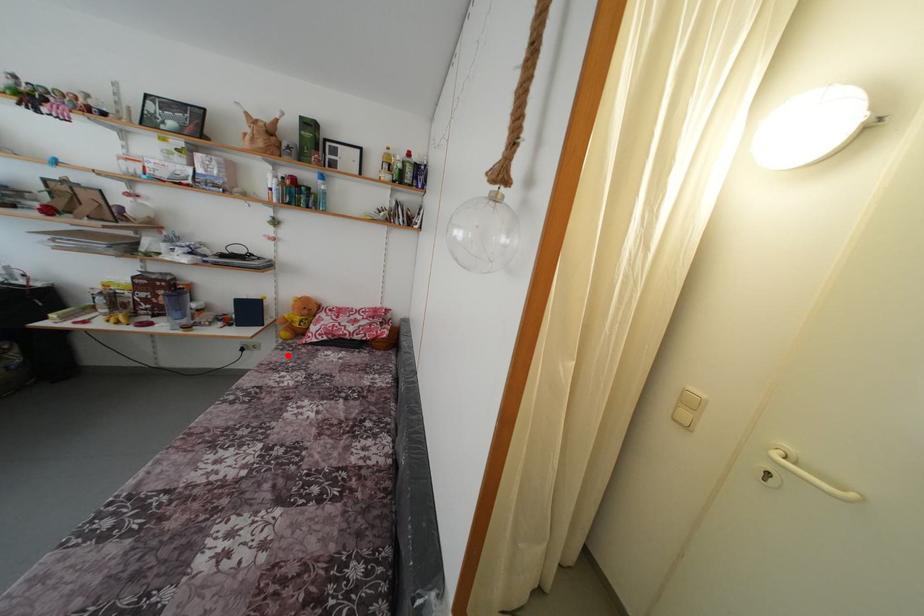
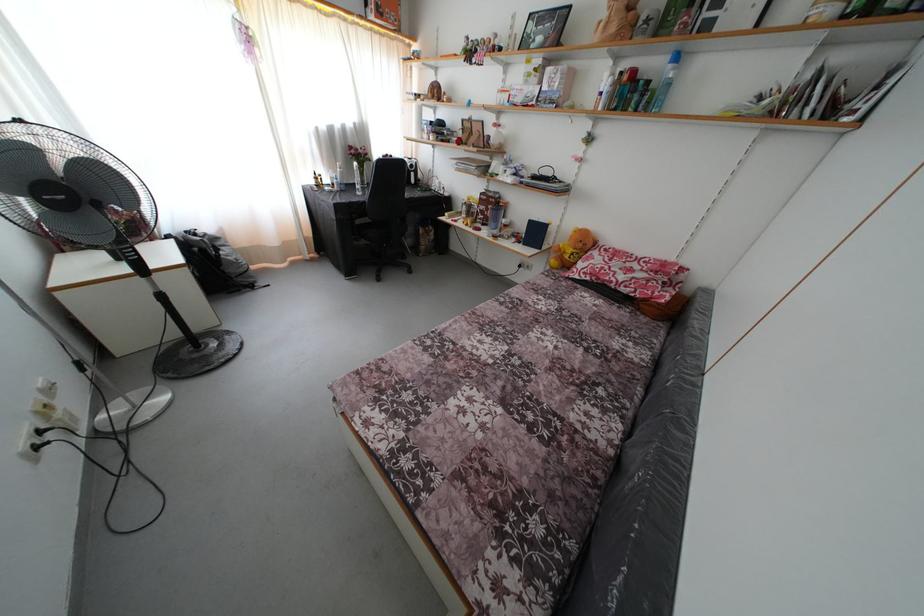
The point at the highlighted location is marked in the first image. Where is the corresponding point in the second image?

(552, 282)